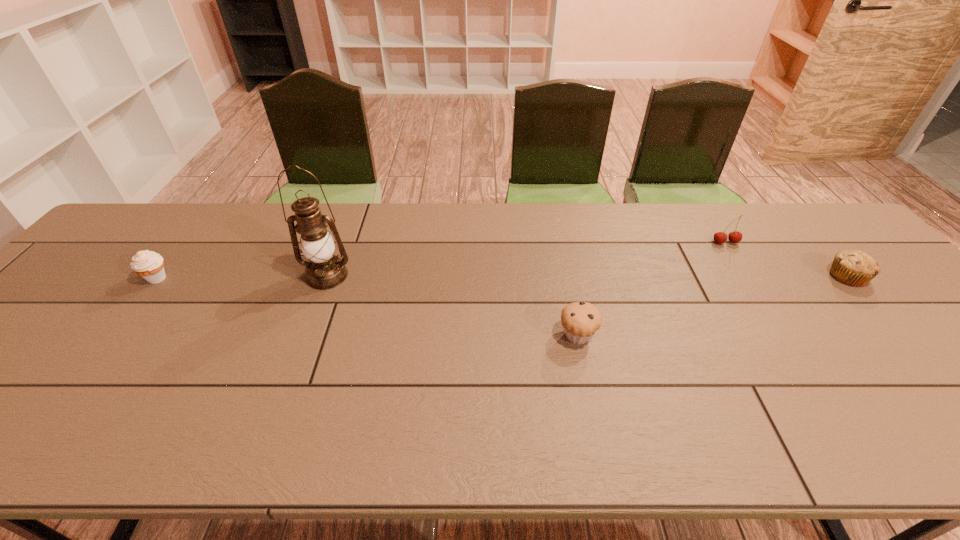
You are a GUI agent. You are given a task and a screenshot of the screen. Output one action in this format:
    pyautogui.click(x=<x>, y=<y>)
    Task: Click on the empty space between the leftmost muffin and the tallest object
    
    Given the screenshot: What is the action you would take?
    pyautogui.click(x=243, y=277)

Where is `vacant area between the nearest object and the tallest object`? vacant area between the nearest object and the tallest object is located at coordinates (452, 306).

You are a GUI agent. You are given a task and a screenshot of the screen. Output one action in this format:
    pyautogui.click(x=<x>, y=<y>)
    Task: Click on the vacant area that lies between the third object from left to right and the fourth object from left to right
    The height and width of the screenshot is (540, 960).
    Given the screenshot: What is the action you would take?
    pyautogui.click(x=652, y=289)

I want to click on vacant point located between the cherry and the leftmost muffin, so click(x=442, y=260).

This screenshot has height=540, width=960. Find the location of `free space between the rightmost muffin and the fourth object from left to right`. free space between the rightmost muffin and the fourth object from left to right is located at coordinates (786, 260).

At what (x,y) coordinates should I click in order to perform the action: click on free point between the rightmost muffin and the nearest object. Please return your answer as a coordinate pair (x, y). Image resolution: width=960 pixels, height=540 pixels. Looking at the image, I should click on (712, 306).

Find the location of `free space between the farthest object and the second object from left to right`. free space between the farthest object and the second object from left to right is located at coordinates (526, 259).

Locate an element on the screen. vacant area that lies between the nearest object and the oil lamp is located at coordinates (452, 306).

Find the location of a particular element. vacant area that lies between the second muffin from left to right and the second object from right to left is located at coordinates (652, 289).

Identify the location of free space between the leftmost muffin and the rightmost object. The image size is (960, 540). (502, 278).